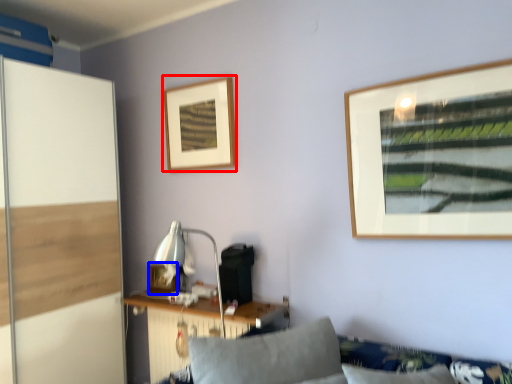
Question: Which object appears closest to the camera in this image, picture frame (highlighted by a red box) or picture frame (highlighted by a blue box)?

Choices:
 (A) picture frame
 (B) picture frame

Answer: (A)